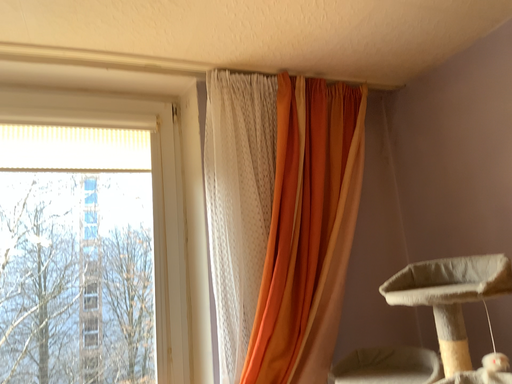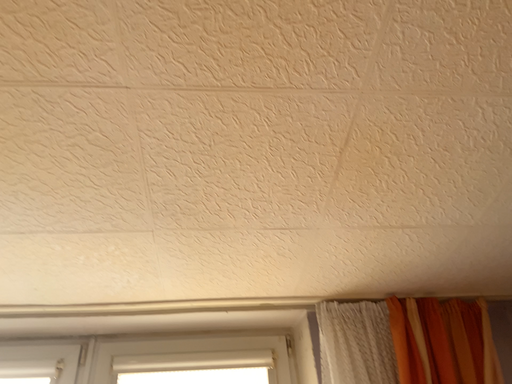
Question: Which way did the camera rotate in the video?

Choices:
 (A) rotated upward
 (B) rotated downward

Answer: (A)